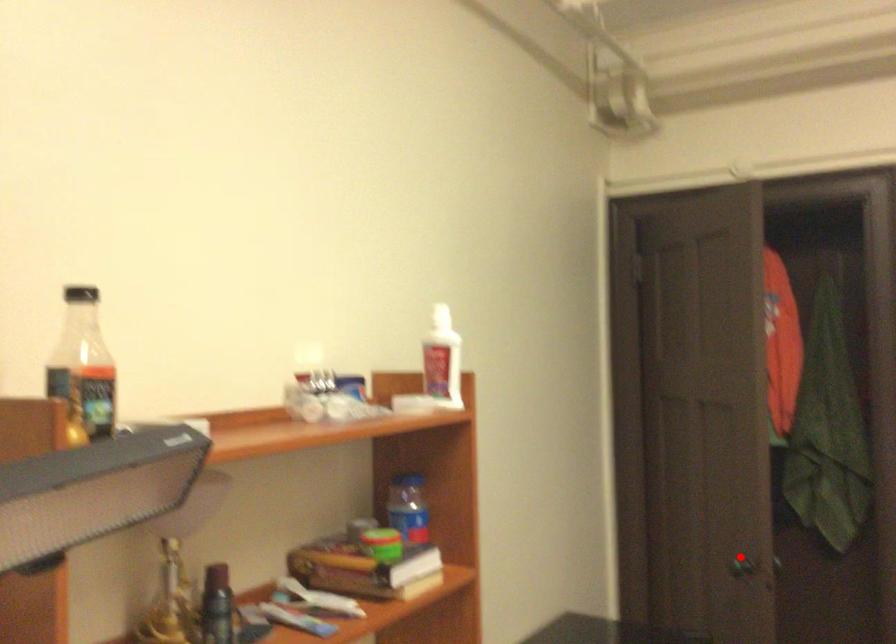
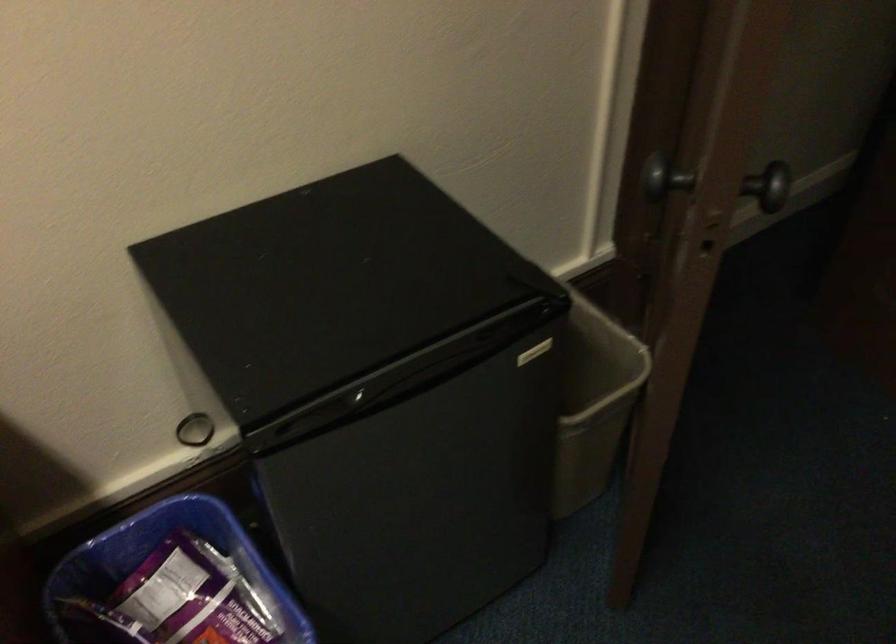
Question: A red point is marked in image1. In image2, is the corresponding 3D point closer to the camera or farther? Reply with the corresponding letter.

Choices:
 (A) The corresponding 3D point is closer.
 (B) The corresponding 3D point is farther.

Answer: (A)